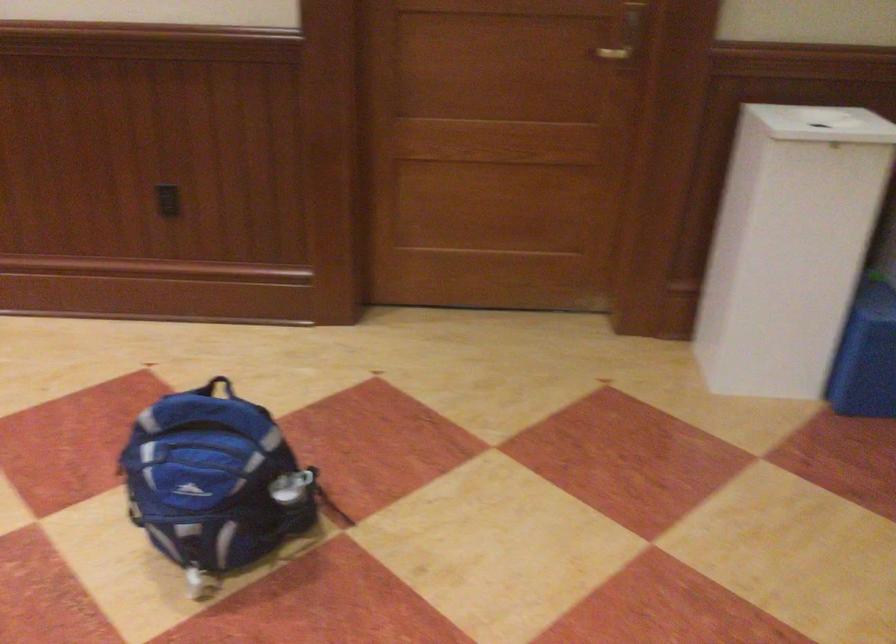
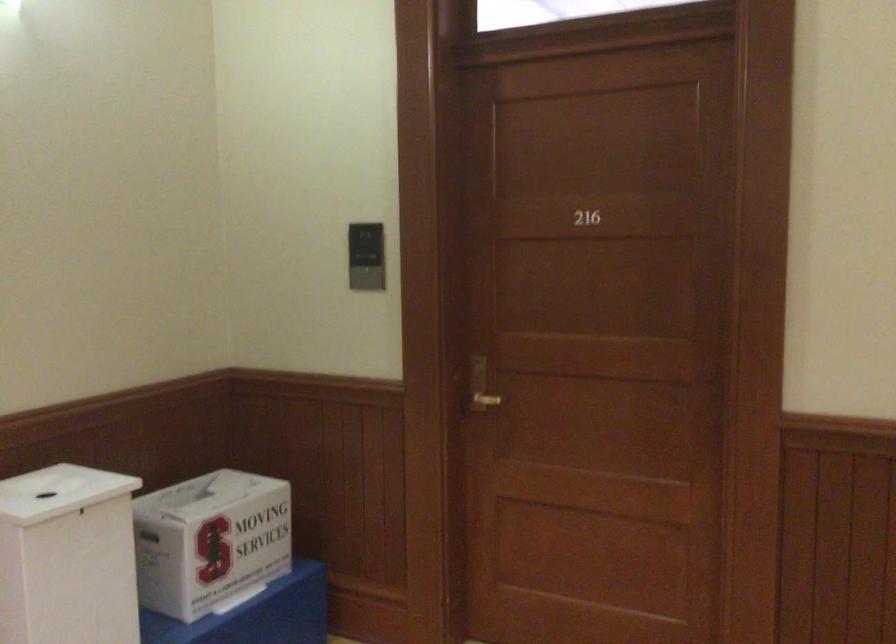
Question: The camera is either moving clockwise (left) or counter-clockwise (right) around the object. The first image is from the beginning of the video and the second image is from the end. Is the camera moving left or right when shooting the video?

Choices:
 (A) Left
 (B) Right

Answer: (A)